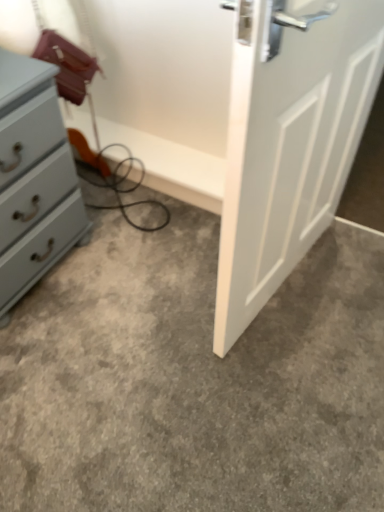
Question: Would you say gray carpet at center is to the left or to the right of matte gray chest of drawers at left in the picture?

Choices:
 (A) right
 (B) left

Answer: (A)

Question: Looking at the image, does gray carpet at center seem bigger or smaller compared to matte gray chest of drawers at left?

Choices:
 (A) small
 (B) big

Answer: (A)

Question: In terms of width, does gray carpet at center look wider or thinner when compared to matte gray chest of drawers at left?

Choices:
 (A) thin
 (B) wide

Answer: (B)

Question: From the image's perspective, relative to gray carpet at center, is matte gray chest of drawers at left above or below?

Choices:
 (A) above
 (B) below

Answer: (A)

Question: From their relative heights in the image, would you say matte gray chest of drawers at left is taller or shorter than gray carpet at center?

Choices:
 (A) short
 (B) tall

Answer: (B)

Question: Is matte gray chest of drawers at left spatially inside gray carpet at center, or outside of it?

Choices:
 (A) outside
 (B) inside

Answer: (A)

Question: Considering the positions of matte gray chest of drawers at left and gray carpet at center in the image, is matte gray chest of drawers at left wider or thinner than gray carpet at center?

Choices:
 (A) wide
 (B) thin

Answer: (B)